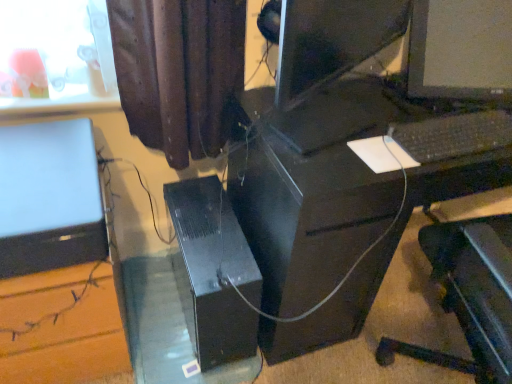
You are a GUI agent. You are given a task and a screenshot of the screen. Output one action in this format:
    pyautogui.click(x=<x>, y=<y>)
    Task: Click on the vacant space to the left of black plastic keyboard at center
    This screenshot has width=512, height=384.
    Given the screenshot: What is the action you would take?
    pyautogui.click(x=351, y=117)